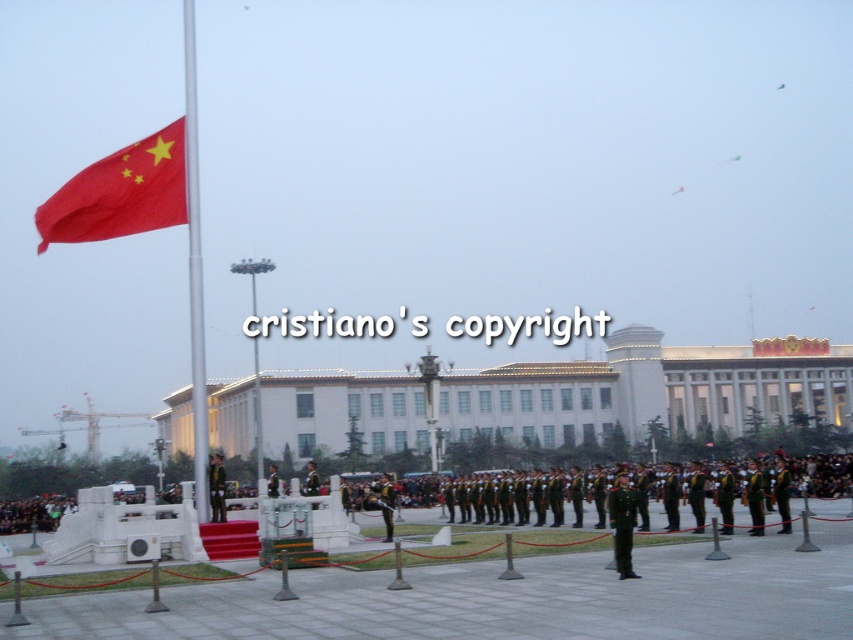
Is red matte flag at upper left thinner than green uniform at center?

In fact, red matte flag at upper left might be wider than green uniform at center.

Can you confirm if red matte flag at upper left is positioned to the right of green uniform at center?

No, red matte flag at upper left is not to the right of green uniform at center.

The height and width of the screenshot is (640, 853). I want to click on red matte flag at upper left, so click(120, 193).

This screenshot has width=853, height=640. What are the coordinates of `red matte flag at upper left` in the screenshot? It's located at (120, 193).

The image size is (853, 640). In order to click on red matte flag at upper left in this screenshot , I will do coord(120,193).

Does silver metallic flag pole at left have a smaller size compared to green uniform at center?

Incorrect, silver metallic flag pole at left is not smaller in size than green uniform at center.

Which is behind, point (186, 36) or point (383, 504)?

Positioned behind is point (186, 36).

Locate an element on the screen. The width and height of the screenshot is (853, 640). silver metallic flag pole at left is located at coordinates (194, 268).